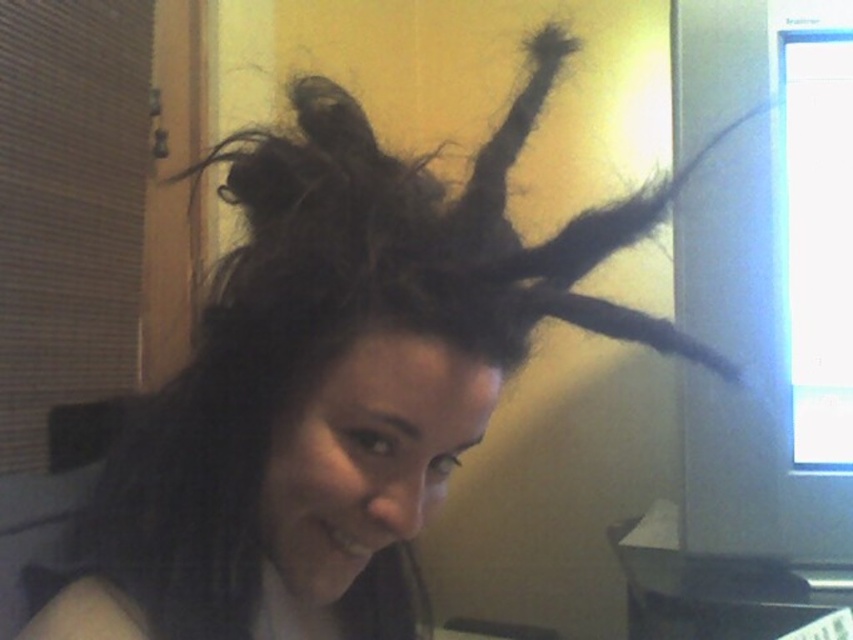
You are a photographer adjusting the lighting in the room. You notice the dark fuzzy hair at center is casting a shadow on the yellow wall. Where would you place a reflector to reduce the shadow?

The dark fuzzy hair at center is located at point (424, 234). To reduce the shadow on the yellow wall, place the reflector opposite the window light source, which is the primary light source, to bounce light back onto the hair and minimize shadow formation.

You are setting up a new monitor and want to ensure it fits on your desk. The matte black monitor at right and the metallic gray computer desk at lower right are in the scene. Based on their sizes, can the monitor be placed on the desk without overhanging the edges?

The matte black monitor at right is taller than the metallic gray computer desk at lower right, so placing the monitor on the desk may cause it to overhang the edges since it is taller than the desk itself.

You are a photographer setting up for a portrait. You have a camera that can focus on objects within a 60 cm range. You see the dark fuzzy hair at center and the metallic gray computer desk at lower right. Can your camera focus on both subjects simultaneously?

The dark fuzzy hair at center is 72.14 centimeters away from the metallic gray computer desk at lower right. Since the camera can only focus within a 60 cm range, it cannot focus on both subjects at the same time because the distance between them exceeds the focus range.